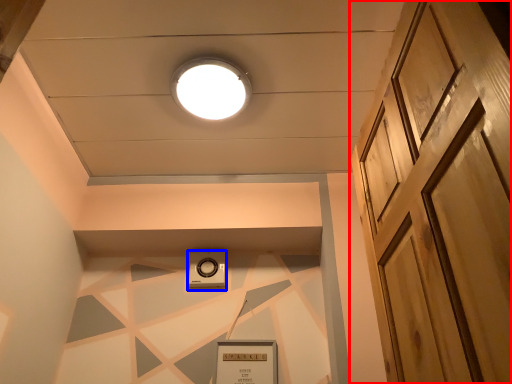
Question: Which point is closer to the camera, door (highlighted by a red box) or thermostat (highlighted by a blue box)?

Choices:
 (A) door
 (B) thermostat

Answer: (A)